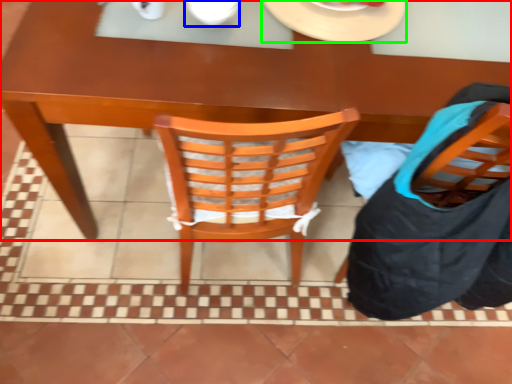
Question: Based on their relative distances, which object is farther from desk (highlighted by a red box)? Choose from tableware (highlighted by a blue box) and plate (highlighted by a green box).

Choices:
 (A) tableware
 (B) plate

Answer: (A)